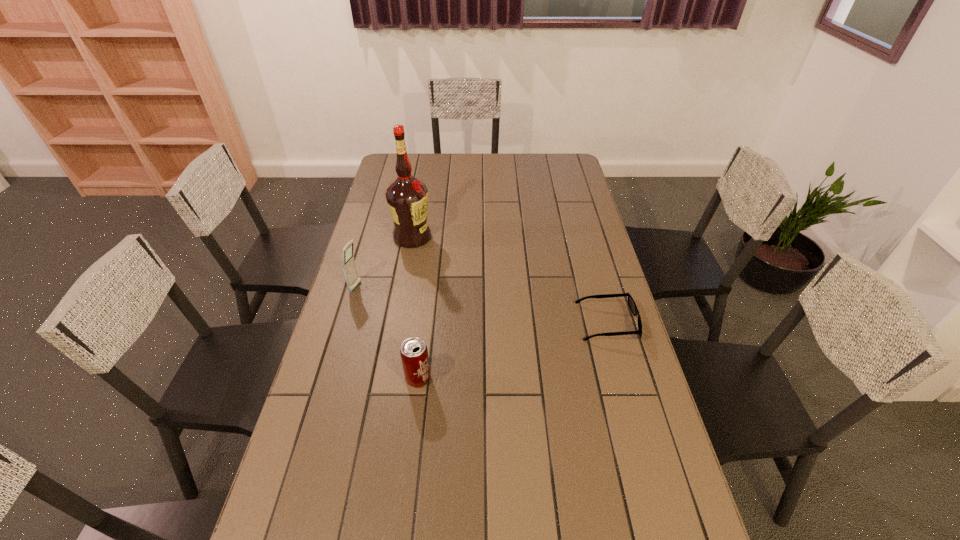
You are a GUI agent. You are given a task and a screenshot of the screen. Output one action in this format:
    pyautogui.click(x=<x>, y=<y>)
    Task: Click on the free space on the desktop that is between the beer can and the third farthest object and is positioned on the front-facing side of the third nearest object
    
    Given the screenshot: What is the action you would take?
    pyautogui.click(x=545, y=342)

Where is `vacant space on the desktop that is between the third tallest object and the third farthest object and is positioned on the label of the alcohol`? The width and height of the screenshot is (960, 540). vacant space on the desktop that is between the third tallest object and the third farthest object and is positioned on the label of the alcohol is located at coordinates (507, 353).